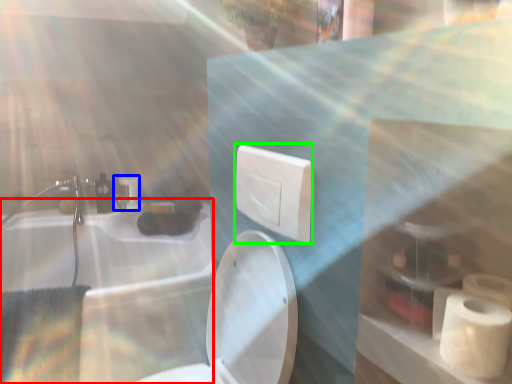
Question: Considering the real-world distances, which object is closest to bath (highlighted by a red box)? faucet (highlighted by a blue box) or electric outlet (highlighted by a green box).

Choices:
 (A) faucet
 (B) electric outlet

Answer: (A)